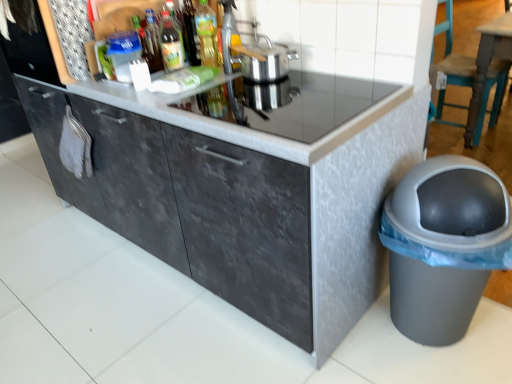
Question: Is green glass bottle at center, placed as the second bottle when sorted from right to left, wider than dark gray textured cabinet at center?

Choices:
 (A) no
 (B) yes

Answer: (A)

Question: Is green glass bottle at center, which is counted as the 3th bottle, starting from the left, bigger than dark gray textured cabinet at center?

Choices:
 (A) no
 (B) yes

Answer: (A)

Question: From the image's perspective, is green glass bottle at center, placed as the second bottle when sorted from right to left, on top of dark gray textured cabinet at center?

Choices:
 (A) no
 (B) yes

Answer: (B)

Question: Is green glass bottle at center, which is counted as the 3th bottle, starting from the left, thinner than dark gray textured cabinet at center?

Choices:
 (A) no
 (B) yes

Answer: (B)

Question: Can you confirm if green glass bottle at center, which is counted as the 3th bottle, starting from the left, is positioned to the right of dark gray textured cabinet at center?

Choices:
 (A) yes
 (B) no

Answer: (B)

Question: In terms of size, does black glass countertop at center appear bigger or smaller than teal wood chair at right?

Choices:
 (A) small
 (B) big

Answer: (A)

Question: Choose the correct answer: Is black glass countertop at center inside teal wood chair at right or outside it?

Choices:
 (A) outside
 (B) inside

Answer: (A)

Question: Is point (135, 94) positioned closer to the camera than point (444, 3)?

Choices:
 (A) farther
 (B) closer

Answer: (B)

Question: Considering the positions of black glass countertop at center and teal wood chair at right in the image, is black glass countertop at center wider or thinner than teal wood chair at right?

Choices:
 (A) thin
 (B) wide

Answer: (B)

Question: From the image's perspective, relative to metallic silver pot at upper center, is translucent glass bottle at upper center, which appears as the second bottle when viewed from the left, above or below?

Choices:
 (A) above
 (B) below

Answer: (A)

Question: Relative to metallic silver pot at upper center, is translucent glass bottle at upper center, acting as the third bottle starting from the right, in front or behind?

Choices:
 (A) behind
 (B) front

Answer: (A)

Question: In terms of width, does translucent glass bottle at upper center, acting as the third bottle starting from the right, look wider or thinner when compared to metallic silver pot at upper center?

Choices:
 (A) wide
 (B) thin

Answer: (B)

Question: Based on their sizes in the image, would you say translucent glass bottle at upper center, acting as the third bottle starting from the right, is bigger or smaller than metallic silver pot at upper center?

Choices:
 (A) small
 (B) big

Answer: (A)

Question: Considering their positions, is silver metallic pot at upper center located in front of or behind teal wood chair at right?

Choices:
 (A) behind
 (B) front

Answer: (B)

Question: Is silver metallic pot at upper center taller or shorter than teal wood chair at right?

Choices:
 (A) tall
 (B) short

Answer: (B)